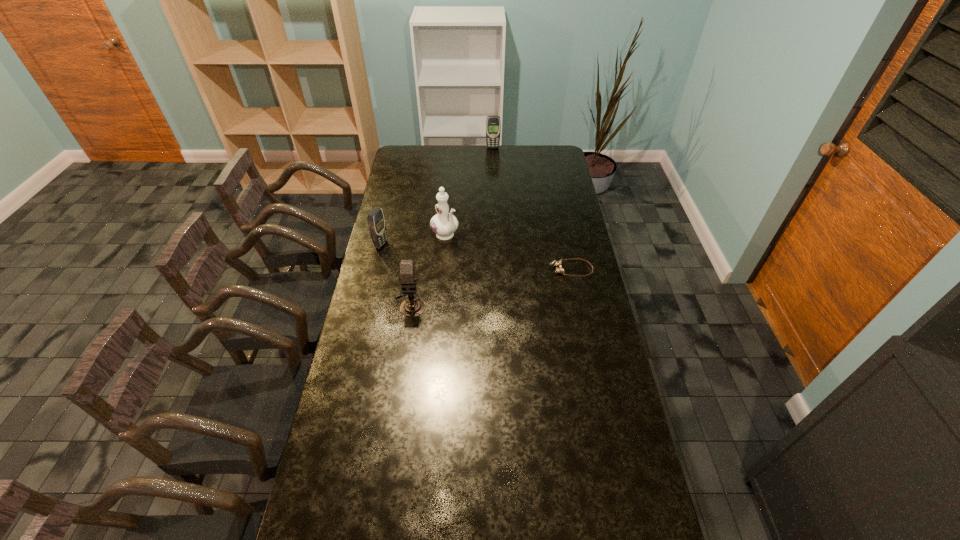
Where is `vacant space on the desktop that is between the nearest object and the goggles and is positioned at the spout of the chinaware`? The height and width of the screenshot is (540, 960). vacant space on the desktop that is between the nearest object and the goggles and is positioned at the spout of the chinaware is located at coordinates (495, 286).

This screenshot has height=540, width=960. I want to click on free space on the desktop that is between the microphone and the goggles and is positioned on the screen of the farthest object, so click(x=501, y=285).

Locate an element on the screen. The height and width of the screenshot is (540, 960). free space on the desktop that is between the nearest object and the second nearest object and is positioned on the front face of the leftmost object is located at coordinates (509, 283).